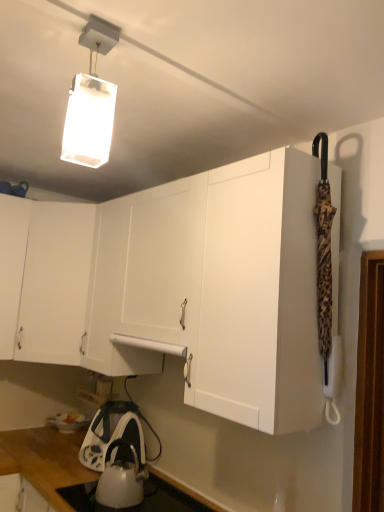
Where is `vacant area that is situated to the right of white glossy kettle at lower center`? vacant area that is situated to the right of white glossy kettle at lower center is located at coordinates (172, 494).